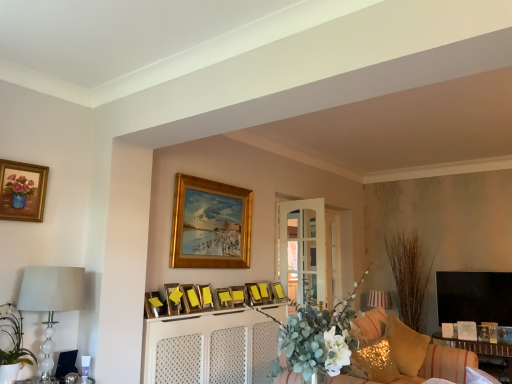
Question: In the image, is matte gold picture frame at upper left, the 11th picture frame viewed from the right, positioned in front of or behind white textured cabinet at center?

Choices:
 (A) behind
 (B) front

Answer: (B)

Question: In terms of width, does matte gold picture frame at upper left, the 1th picture frame viewed from the left, look wider or thinner when compared to white textured cabinet at center?

Choices:
 (A) thin
 (B) wide

Answer: (A)

Question: Considering the real-world distances, which object is farthest from the wooden picture frame at center, placed as the tenth picture frame when sorted from right to left?

Choices:
 (A) white glossy lampshade at upper center, positioned as the first lamp in bottom-to-top order
 (B) gold wooden picture frame at upper center, which appears as the sixth picture frame when viewed from the left
 (C) white matte floral arrangement at center
 (D) wooden table at lower right
 (E) matte yellow picture frame at center, positioned as the 5th picture frame in right-to-left order

Answer: (D)

Question: Which of these objects is positioned farthest from the gold sequined pillow at lower right, which is the second pillow in back-to-front order?

Choices:
 (A) wooden picture frame at center, the 3th picture frame positioned from the left
 (B) wooden picture frame at center, the 2th picture frame viewed from the right
 (C) white matte floral arrangement at center
 (D) white glass lamp at left, acting as the 1th lamp starting from the top
 (E) wooden table at lower right

Answer: (D)